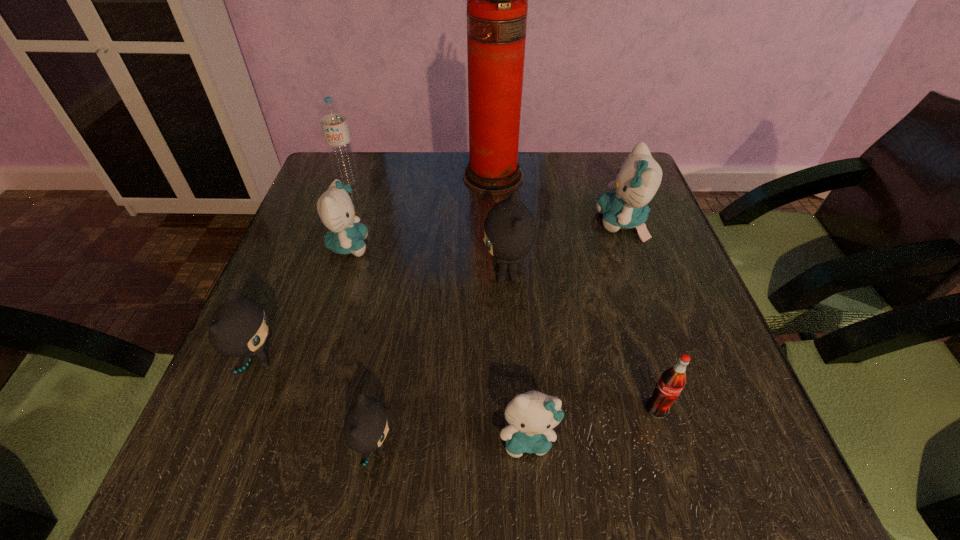
You are a GUI agent. You are given a task and a screenshot of the screen. Output one action in this format:
    pyautogui.click(x=<x>, y=<y>)
    Task: Click on the vacant space situated 0.190m on the face of the rightmost blue kitten
    
    Given the screenshot: What is the action you would take?
    pyautogui.click(x=517, y=222)

You are a GUI agent. You are given a task and a screenshot of the screen. Output one action in this format:
    pyautogui.click(x=<x>, y=<y>)
    Task: Click on the vacant space located on the face of the rightmost blue kitten
    This screenshot has width=960, height=540.
    Given the screenshot: What is the action you would take?
    pyautogui.click(x=517, y=222)

The width and height of the screenshot is (960, 540). I want to click on vacant space situated 0.130m on the front-facing side of the rightmost gray kitten, so click(x=422, y=274).

Find the location of a particular element. The image size is (960, 540). vacant space located 0.220m on the front-facing side of the rightmost gray kitten is located at coordinates (380, 274).

Identify the location of free spot located 0.190m on the front-facing side of the rightmost gray kitten. Image resolution: width=960 pixels, height=540 pixels. (395, 274).

This screenshot has height=540, width=960. Identify the location of vacant space situated on the face of the leftmost blue kitten. (405, 246).

Where is `vacant space located on the label of the soda bottle`? vacant space located on the label of the soda bottle is located at coordinates (671, 456).

Locate an element on the screen. This screenshot has width=960, height=540. free location located 0.360m on the front-facing side of the second biggest gray kitten is located at coordinates (483, 360).

Locate an element on the screen. This screenshot has height=540, width=960. blank area located on the front-facing side of the third kitten from left to right is located at coordinates (511, 447).

I want to click on fire extinguisher that is at the far edge, so click(497, 0).